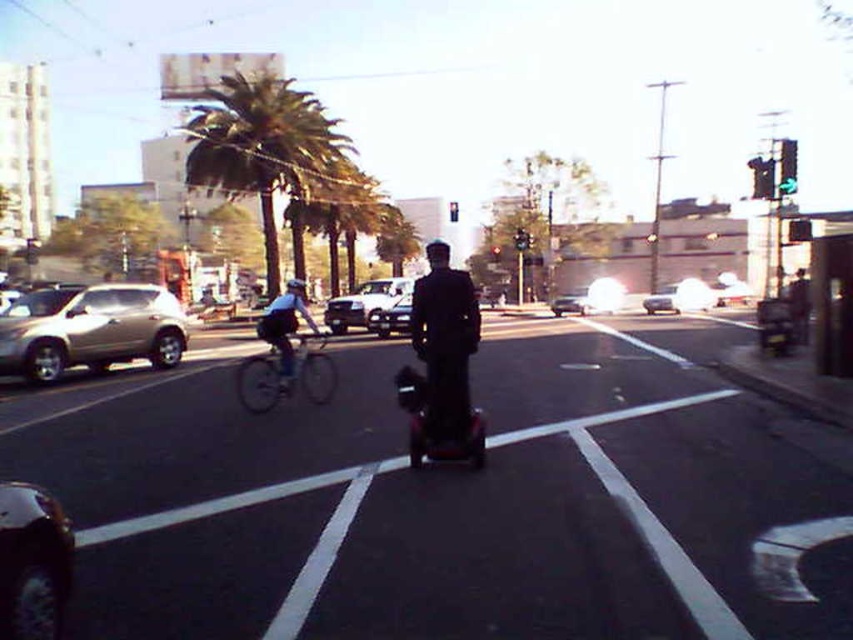
Question: Can you confirm if black glossy scooter at center is smaller than silver metallic bicycle at center-left?

Choices:
 (A) yes
 (B) no

Answer: (A)

Question: Is satin gold suv at left below metallic silver sedan at center?

Choices:
 (A) no
 (B) yes

Answer: (B)

Question: Which point appears closest to the camera in this image?

Choices:
 (A) (416, 376)
 (B) (254, 397)
 (C) (554, 301)
 (D) (473, 541)

Answer: (D)

Question: Can you confirm if black matte hoverboard at center is thinner than dark matte suit at center?

Choices:
 (A) no
 (B) yes

Answer: (A)

Question: Which object appears closest to the camera in this image?

Choices:
 (A) white glossy sedan at center
 (B) silver metallic sedan at center

Answer: (A)

Question: Among these objects, which one is nearest to the camera?

Choices:
 (A) shiny black car at lower left
 (B) black matte hoverboard at center

Answer: (A)